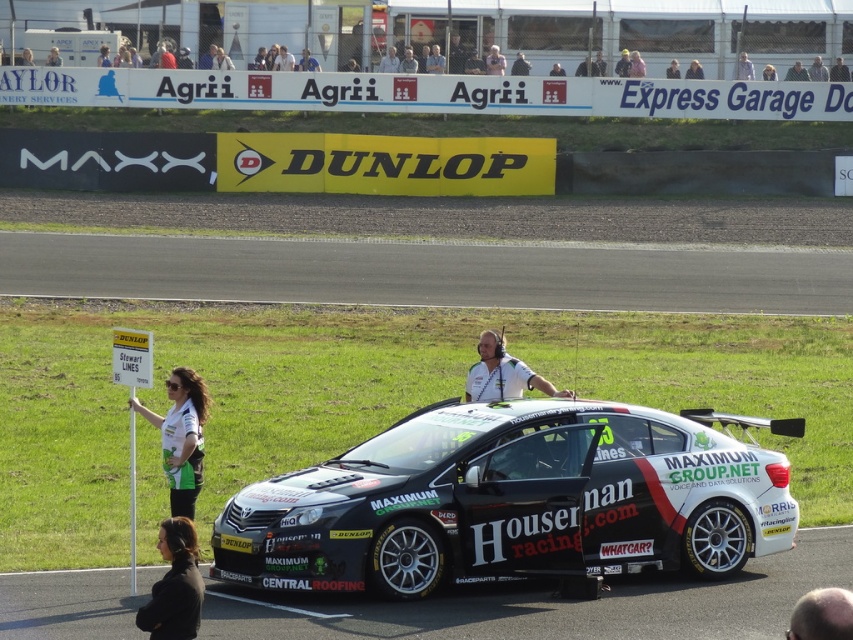
Does dirt track at center appear under black fabric at lower left?

Actually, dirt track at center is above black fabric at lower left.

Which is below, dirt track at center or black fabric at lower left?

black fabric at lower left

The width and height of the screenshot is (853, 640). Describe the element at coordinates (448, 216) in the screenshot. I see `dirt track at center` at that location.

You are a GUI agent. You are given a task and a screenshot of the screen. Output one action in this format:
    pyautogui.click(x=<x>, y=<y>)
    Task: Click on the dirt track at center
    
    Given the screenshot: What is the action you would take?
    pyautogui.click(x=448, y=216)

Looking at this image, is asphalt at center further to the viewer compared to black fabric at lower left?

Yes, asphalt at center is further from the viewer.

Does asphalt at center have a lesser height compared to black fabric at lower left?

No, asphalt at center is not shorter than black fabric at lower left.

Identify the location of asphalt at center. This screenshot has height=640, width=853. (428, 273).

Looking at this image, is black rubber race track at lower center above light brown leather jacket at upper center?

No, black rubber race track at lower center is not above light brown leather jacket at upper center.

Is point (654, 593) in front of point (798, 76)?

Yes, point (654, 593) is closer to viewer.

Where is `black rubber race track at lower center`? black rubber race track at lower center is located at coordinates [x=552, y=604].